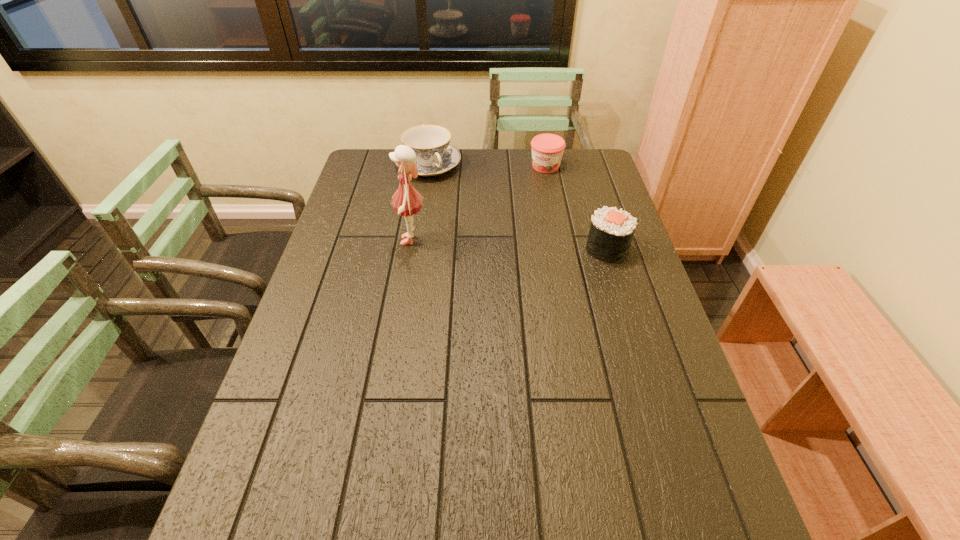
This screenshot has width=960, height=540. What are the coordinates of `object at the far left corner` in the screenshot? It's located at (434, 155).

The width and height of the screenshot is (960, 540). What are the coordinates of `object at the far right corner` in the screenshot? It's located at (547, 149).

Image resolution: width=960 pixels, height=540 pixels. I want to click on free space at the far edge of the desktop, so click(x=446, y=177).

In the image, there is a desktop. Where is `vacant region at the left edge`? The height and width of the screenshot is (540, 960). vacant region at the left edge is located at coordinates (349, 191).

You are a GUI agent. You are given a task and a screenshot of the screen. Output one action in this format:
    pyautogui.click(x=<x>, y=<y>)
    Task: Click on the vacant space at the right edge of the desktop
    
    Given the screenshot: What is the action you would take?
    pyautogui.click(x=619, y=266)

Locate an element on the screen. This screenshot has height=540, width=960. vacant position at the near left corner of the desktop is located at coordinates pyautogui.click(x=248, y=477).

Where is `vacant space at the far right corner`? The height and width of the screenshot is (540, 960). vacant space at the far right corner is located at coordinates (596, 183).

In the image, there is a desktop. In order to click on free space at the near right corner in this screenshot , I will do `click(647, 482)`.

Where is `free space between the second object from right to left and the tallest object`? Image resolution: width=960 pixels, height=540 pixels. free space between the second object from right to left and the tallest object is located at coordinates (479, 204).

Identify the location of vacant area that lies between the chinaware and the second object from right to left. (487, 166).